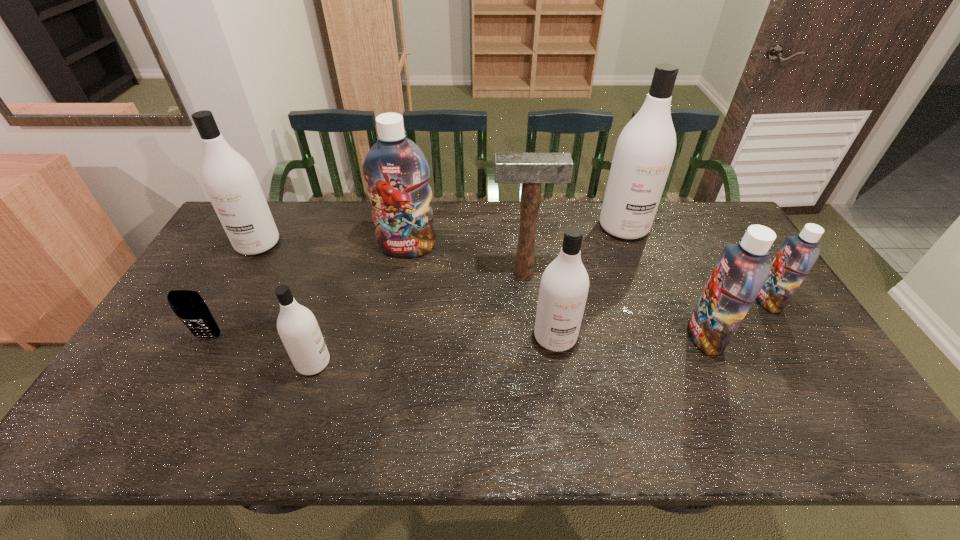
The image size is (960, 540). I want to click on the fourth closest white shampoo relative to the cellular telephone, so click(645, 149).

At what (x,y) coordinates should I click in order to perform the action: click on the second closest blue shampoo to the shortest object. Please return your answer as a coordinate pair (x, y). This screenshot has height=540, width=960. Looking at the image, I should click on (743, 268).

Where is `the closest blue shampoo to the sixth nearest object`? The width and height of the screenshot is (960, 540). the closest blue shampoo to the sixth nearest object is located at coordinates (396, 171).

Identify the location of blank area in the image that satisfies the following two spatial constraints: 1. on the front label of the second smallest blue shampoo; 2. on the front-facing side of the fourth shampoo from left to right. The image size is (960, 540). (705, 337).

Locate an element on the screen. The width and height of the screenshot is (960, 540). vacant area that satisfies the following two spatial constraints: 1. on the front label of the smallest blue shampoo; 2. on the screen of the shortest object is located at coordinates (790, 336).

Image resolution: width=960 pixels, height=540 pixels. What are the coordinates of `blank space that satisfies the following two spatial constraints: 1. on the front label of the sixth nearest object; 2. on the left side of the farthest blue shampoo` in the screenshot? It's located at point(403,274).

Find the location of a particular element. free space that satisfies the following two spatial constraints: 1. on the front label of the sixth nearest object; 2. on the left side of the biggest blue shampoo is located at coordinates coord(403,274).

You are a GUI agent. You are given a task and a screenshot of the screen. Output one action in this format:
    pyautogui.click(x=<x>, y=<y>)
    Task: Click on the free space in the image that satisfies the following two spatial constraints: 1. on the front-facing side of the tallest object; 2. on the front-facing side of the second white shampoo from left to right
    
    Given the screenshot: What is the action you would take?
    pyautogui.click(x=676, y=363)